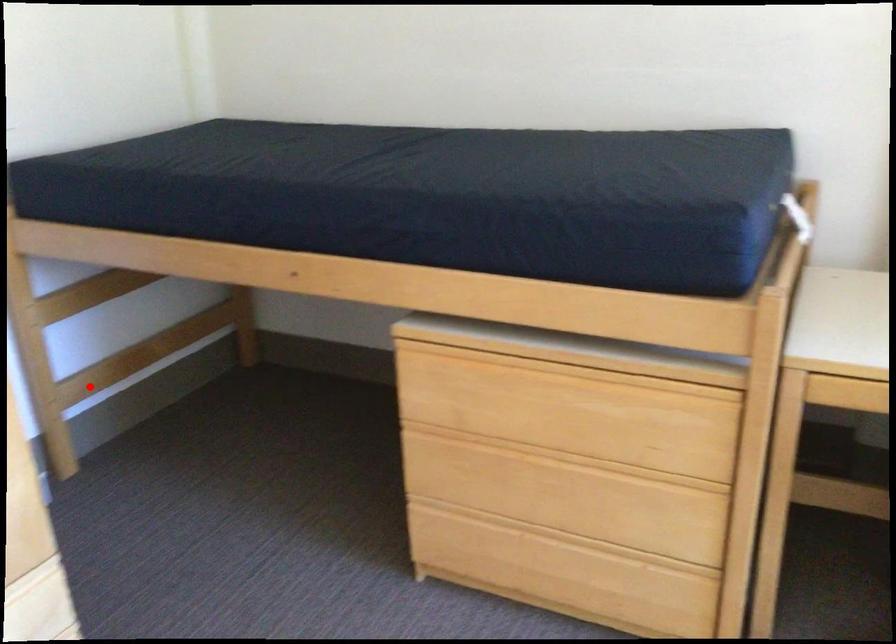
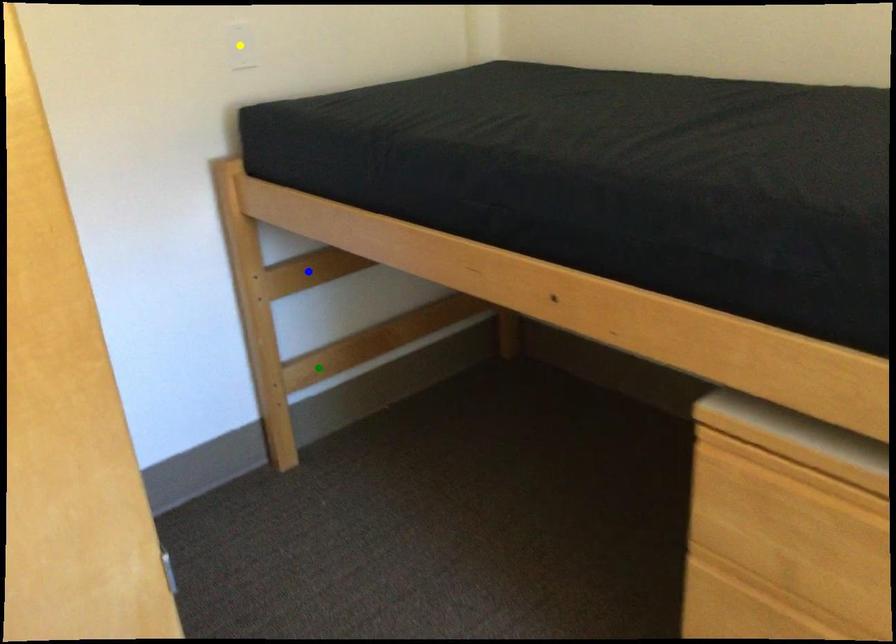
Question: I am providing you with two images of the same scene from different viewpoints. A red point is marked on the first image. You are given multiple points on the second image. Can you choose the point in image 2 that corresponds to the point in image 1?

Choices:
 (A) yellow point
 (B) blue point
 (C) green point

Answer: (C)